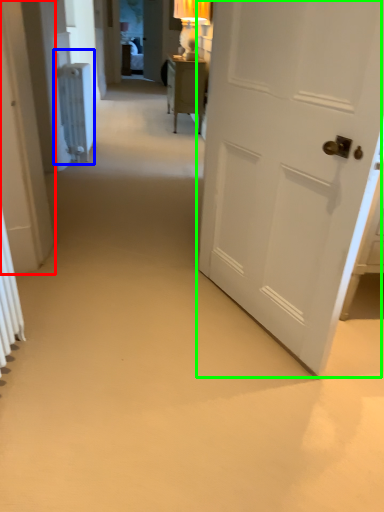
Question: Estimate the real-world distances between objects in this image. Which object is farther from door (highlighted by a red box), radiator (highlighted by a blue box) or door (highlighted by a green box)?

Choices:
 (A) radiator
 (B) door

Answer: (A)